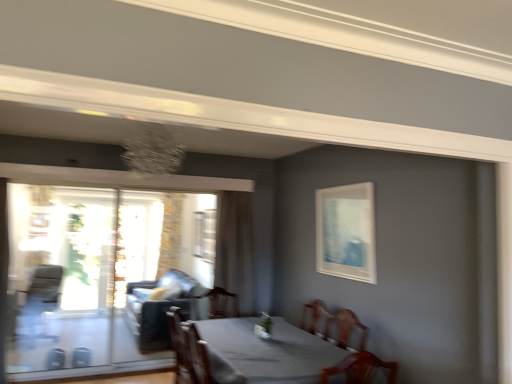
Question: Which direction should I rotate to look at brown sheer curtain at center, the first curtain viewed from the front, — up or down?

Choices:
 (A) down
 (B) up

Answer: (A)

Question: From a real-world perspective, is transparent glass screen door at left positioned over leather armchair at left, placed as the first armchair when sorted from left to right, based on gravity?

Choices:
 (A) yes
 (B) no

Answer: (A)

Question: Can you confirm if transparent glass screen door at left is shorter than leather armchair at left, positioned as the 2th armchair in front-to-back order?

Choices:
 (A) no
 (B) yes

Answer: (A)

Question: Can you confirm if transparent glass screen door at left is smaller than leather armchair at left, placed as the first armchair when sorted from left to right?

Choices:
 (A) no
 (B) yes

Answer: (B)

Question: Does transparent glass screen door at left appear on the left side of leather armchair at left, which is counted as the 1th armchair, starting from the back?

Choices:
 (A) yes
 (B) no

Answer: (B)

Question: Is transparent glass screen door at left looking in the opposite direction of leather armchair at left, which is counted as the 1th armchair, starting from the back?

Choices:
 (A) yes
 (B) no

Answer: (A)

Question: Is transparent glass screen door at left oriented towards leather armchair at left, placed as the first armchair when sorted from left to right?

Choices:
 (A) no
 (B) yes

Answer: (A)

Question: Considering the relative sizes of transparent glass screen door at left and clear glass window at center, which is the second window in front-to-back order, in the image provided, is transparent glass screen door at left smaller than clear glass window at center, which is the second window in front-to-back order,?

Choices:
 (A) yes
 (B) no

Answer: (B)

Question: Is transparent glass screen door at left taller than clear glass window at center, placed as the second window when sorted from left to right?

Choices:
 (A) no
 (B) yes

Answer: (B)

Question: Is transparent glass screen door at left outside clear glass window at center, placed as the second window when sorted from left to right?

Choices:
 (A) no
 (B) yes

Answer: (B)

Question: From a real-world perspective, is transparent glass screen door at left beneath clear glass window at center, marked as the 1th window in a back-to-front arrangement?

Choices:
 (A) yes
 (B) no

Answer: (A)

Question: Does transparent glass screen door at left turn towards clear glass window at center, the 1th window viewed from the right?

Choices:
 (A) no
 (B) yes

Answer: (A)

Question: From the image's perspective, is transparent glass screen door at left above clear glass window at center, marked as the 1th window in a back-to-front arrangement?

Choices:
 (A) no
 (B) yes

Answer: (A)

Question: Is clear glass window at center, which is the second window in front-to-back order, smaller than suede-like dark gray couch at left?

Choices:
 (A) no
 (B) yes

Answer: (B)